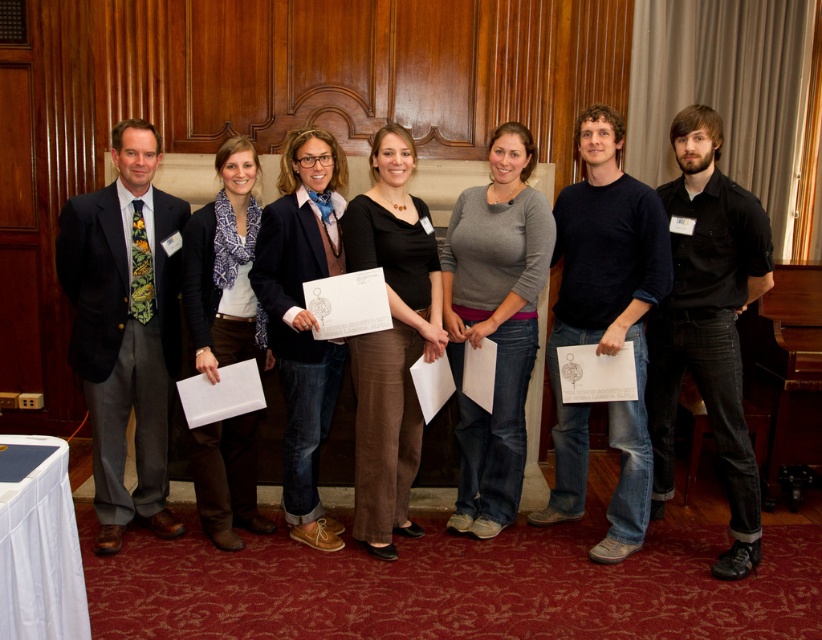
Question: Considering the real-world distances, which object is farthest from the matte black jacket at center?

Choices:
 (A) gray matte sweater at center
 (B) black matte pants at center

Answer: (A)

Question: Does black cotton shirt at right appear on the left side of matte black jacket at center?

Choices:
 (A) no
 (B) yes

Answer: (A)

Question: Is black cotton shirt at right closer to the viewer compared to black matte pants at center?

Choices:
 (A) no
 (B) yes

Answer: (B)

Question: Which object appears closest to the camera in this image?

Choices:
 (A) black cotton shirt at center
 (B) black matte pants at center
 (C) gray matte sweater at center

Answer: (B)

Question: Is dark gray suit at left thinner than brown suede boots at lower left?

Choices:
 (A) no
 (B) yes

Answer: (A)

Question: Which of the following is the farthest from the observer?

Choices:
 (A) black matte pants at center
 (B) brown suede boots at lower left
 (C) gray matte sweater at center

Answer: (C)